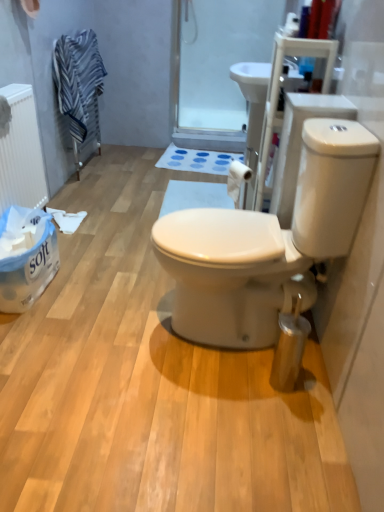
This screenshot has width=384, height=512. In order to click on vacant area that is in front of white paper towel at lower left in this screenshot , I will do `click(33, 337)`.